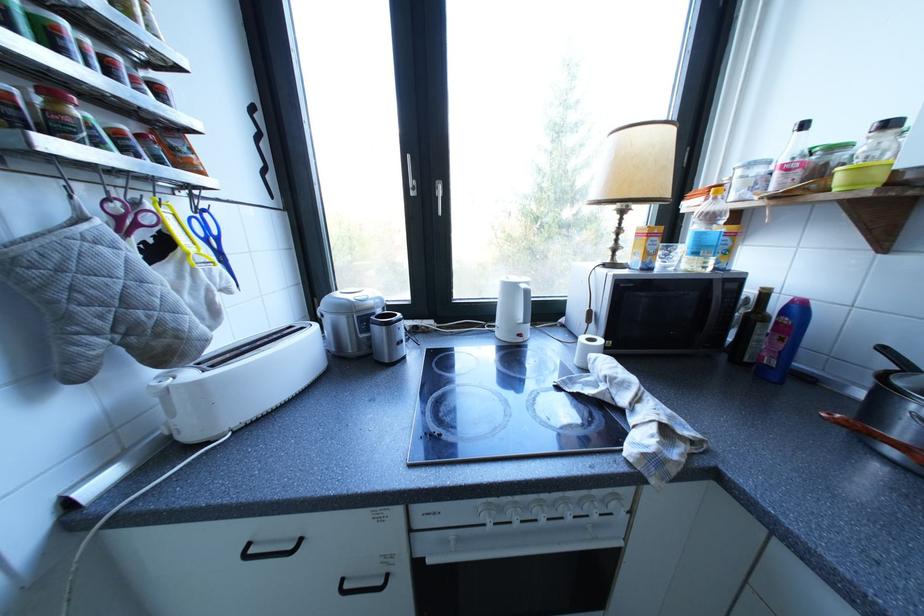
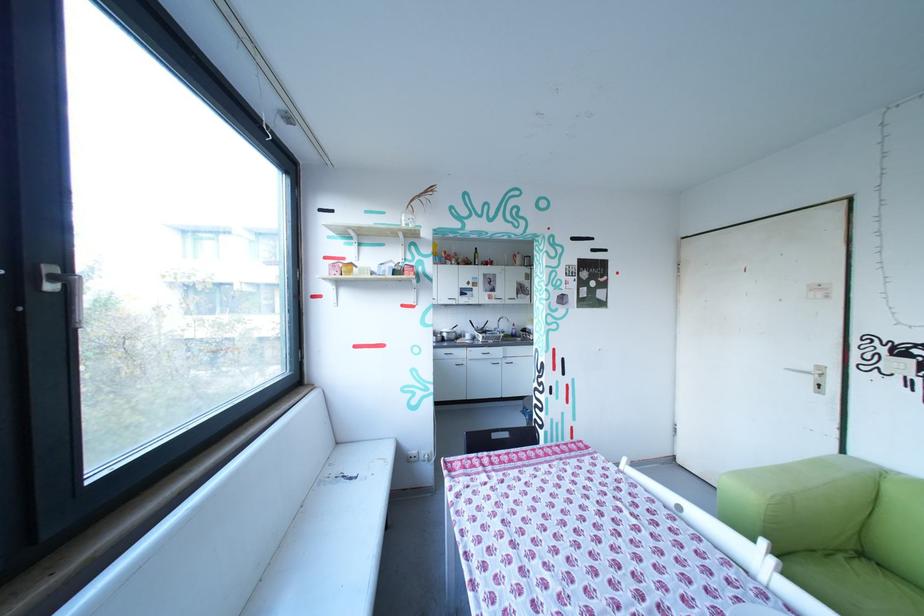
Question: I am providing you with two images of the same scene from different viewpoints. After the viewpoint changes to image2, which objects are now occluded?

Choices:
 (A) bottle with yellow cap
 (B) blue plastic bottle
 (C) silver coin return
 (D) metal cabinet handle

Answer: (B)